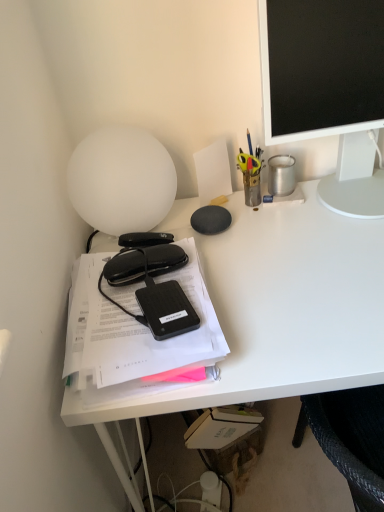
This screenshot has height=512, width=384. I want to click on vacant space in front of metallic pen holder at upper right, the second stationery from the right, so click(254, 229).